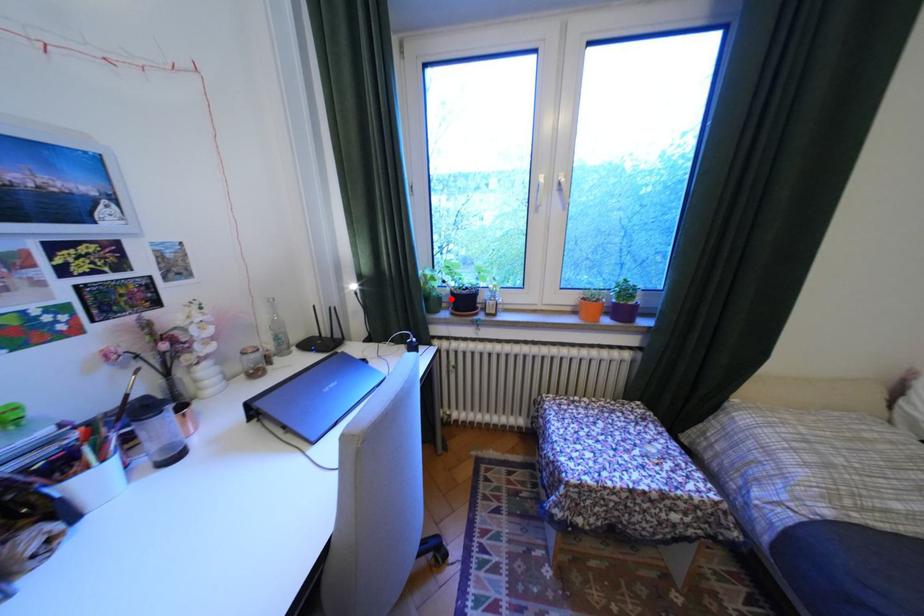
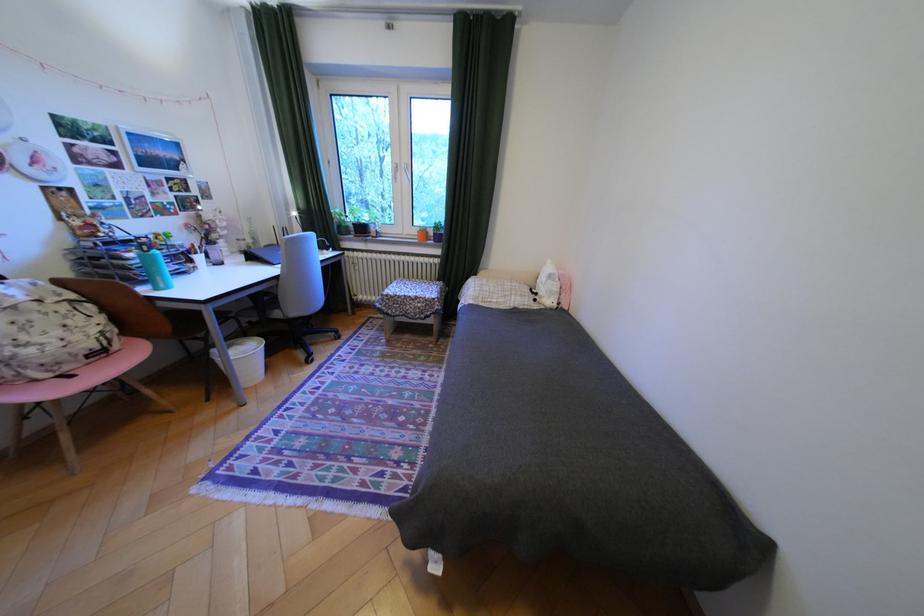
Where in the second image is the point corresponding to the highlighted location from the first image?

(359, 227)